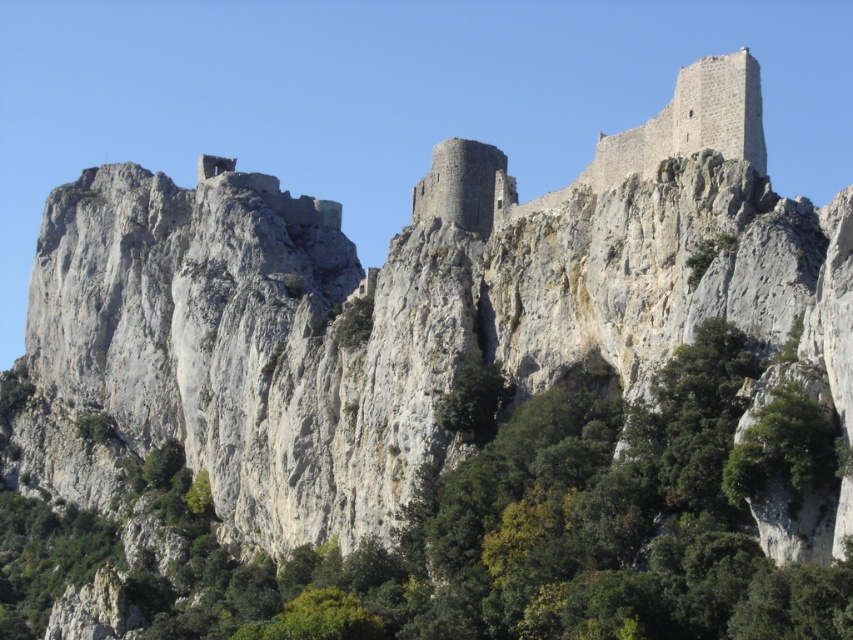
Question: Does green leafy tree at center have a smaller size compared to gray stone castle at upper right?

Choices:
 (A) no
 (B) yes

Answer: (A)

Question: Is green leafy tree at center below gray stone castle at upper right?

Choices:
 (A) no
 (B) yes

Answer: (B)

Question: Which point appears farthest from the camera in this image?

Choices:
 (A) (428, 492)
 (B) (627, 176)

Answer: (A)

Question: Considering the relative positions of green leafy tree at center and gray stone castle at upper right in the image provided, where is green leafy tree at center located with respect to gray stone castle at upper right?

Choices:
 (A) above
 (B) below

Answer: (B)

Question: Which of the following is the farthest from the observer?

Choices:
 (A) gray stone castle at upper right
 (B) green leafy tree at center

Answer: (A)